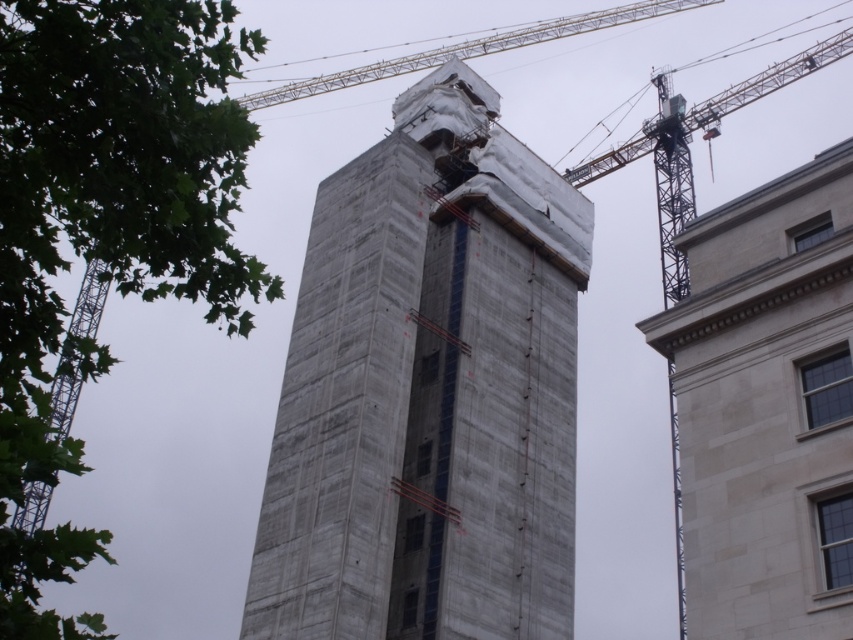
Question: Which point is closer to the camera taking this photo?

Choices:
 (A) [291, 621]
 (B) [801, 566]

Answer: (B)

Question: Can you confirm if concrete tower at center is thinner than light gray stone building at right?

Choices:
 (A) yes
 (B) no

Answer: (B)

Question: Which point appears farthest from the camera in this image?

Choices:
 (A) (737, 442)
 (B) (518, 625)

Answer: (B)

Question: Does concrete tower at center appear on the left side of light gray stone building at right?

Choices:
 (A) yes
 (B) no

Answer: (A)

Question: Does concrete tower at center have a smaller size compared to light gray stone building at right?

Choices:
 (A) no
 (B) yes

Answer: (A)